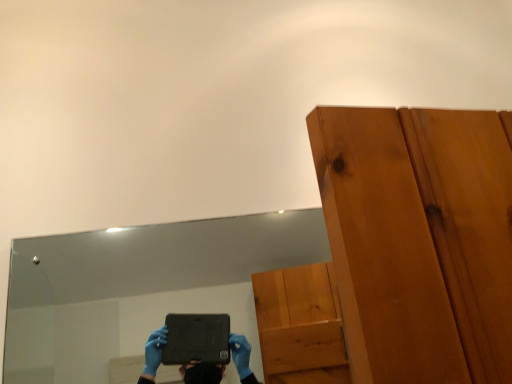
Describe the element at coordinates (141, 287) in the screenshot. I see `clear glass mirror at upper center` at that location.

Locate an element on the screen. This screenshot has width=512, height=384. clear glass mirror at upper center is located at coordinates (141, 287).

This screenshot has width=512, height=384. What are the coordinates of `clear glass mirror at upper center` in the screenshot? It's located at (x=141, y=287).